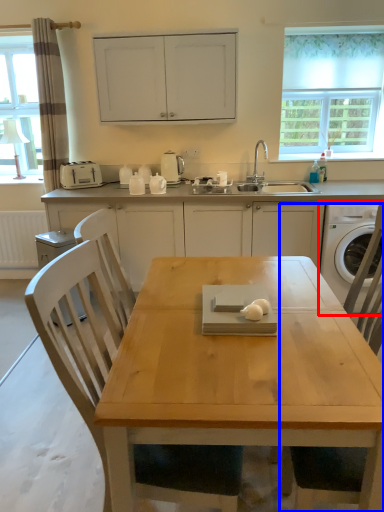
Question: Which object is closer to the camera taking this photo, washing machine (highlighted by a red box) or chair (highlighted by a blue box)?

Choices:
 (A) washing machine
 (B) chair

Answer: (B)